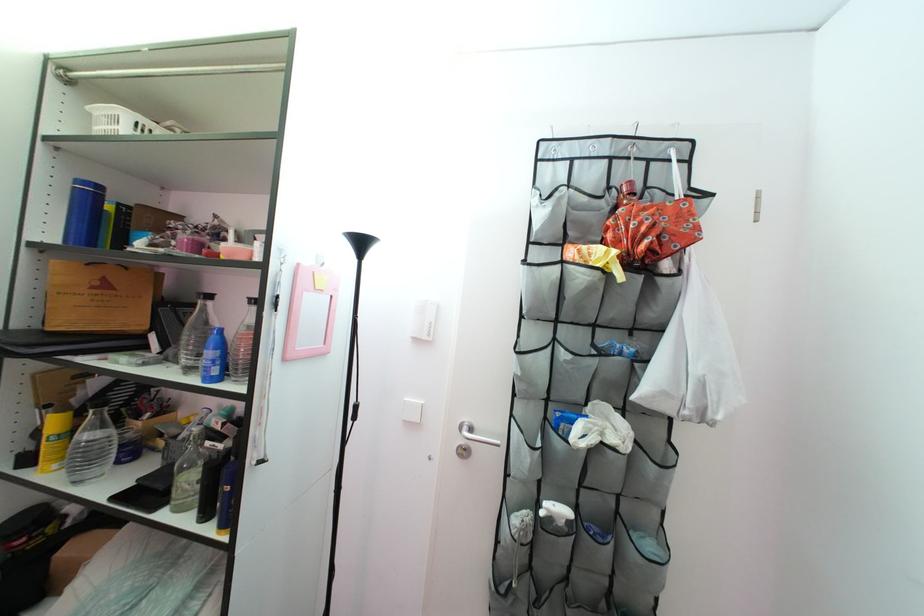
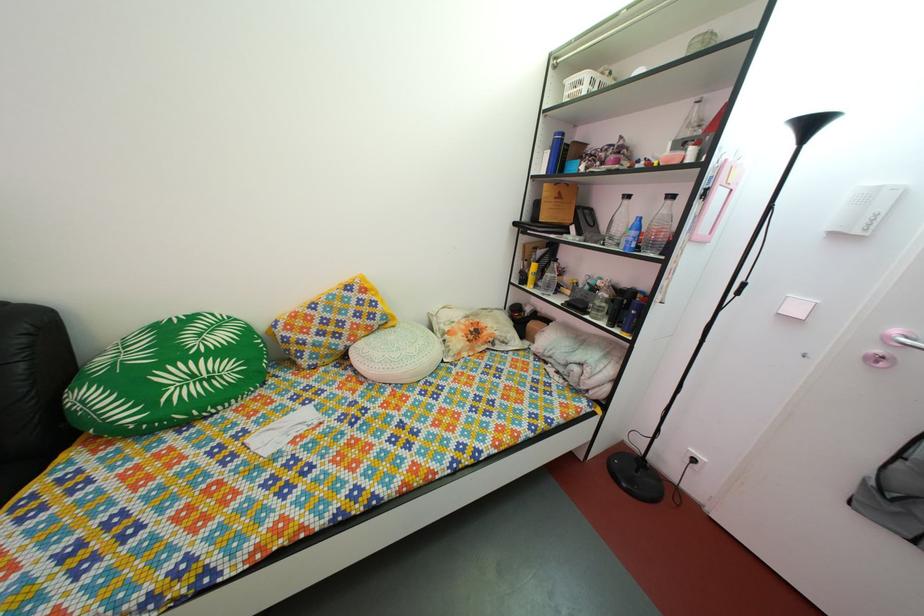
Locate, in the second image, the point that corresponds to the point at 56,456 in the first image.

(540, 286)